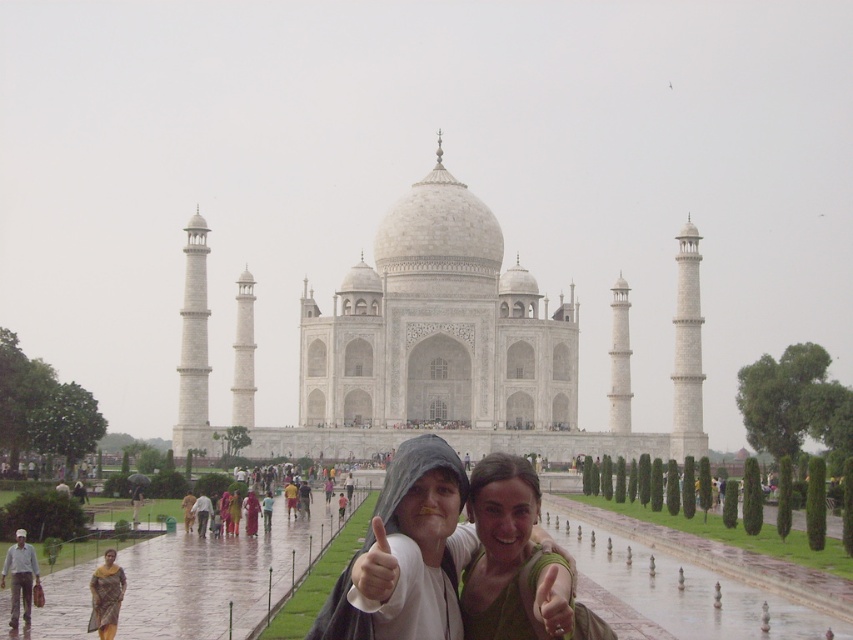
You are a photographer planning to take a group photo of the two people in the scene. The yellow plaid sari at lower left and the light gray cotton shirt at lower left are both in the lower left area. Which clothing item is narrower in width?

The yellow plaid sari at lower left is thinner than the light gray cotton shirt at lower left, so the yellow plaid sari at lower left is narrower in width.

You are a photographer trying to capture the Taj Mahal with both people in the frame. Which person, the light gray cotton shirt at lower left or the light gray cotton shirt at center, is closer to the camera?

The light gray cotton shirt at lower left is closer to the camera since it is in front of the light gray cotton shirt at center.